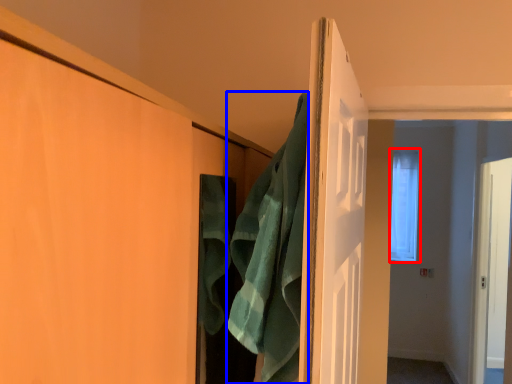
Question: Which object is further to the camera taking this photo, window (highlighted by a red box) or bath towel (highlighted by a blue box)?

Choices:
 (A) window
 (B) bath towel

Answer: (A)